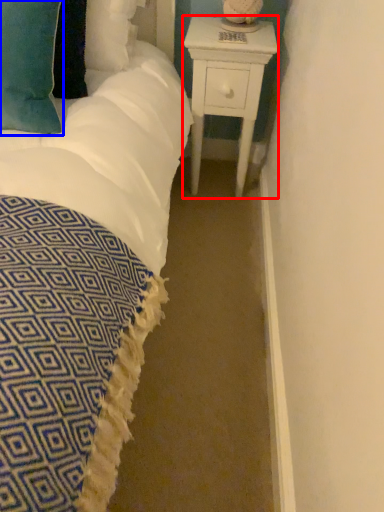
Question: Which object is further to the camera taking this photo, nightstand (highlighted by a red box) or pillow (highlighted by a blue box)?

Choices:
 (A) nightstand
 (B) pillow

Answer: (A)